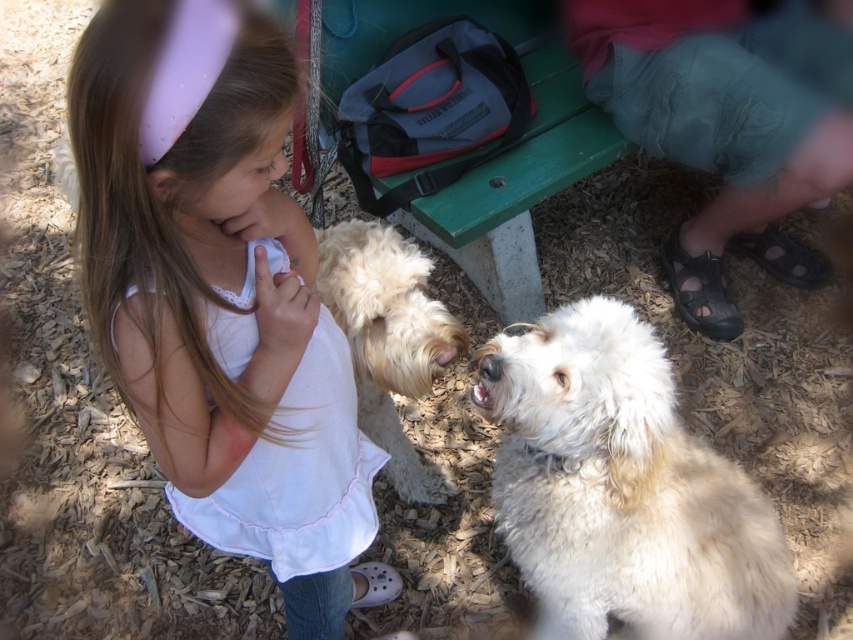
Who is positioned more to the right, white fluffy dog at center or fluffy white dog at center?

Positioned to the right is white fluffy dog at center.

Does white fluffy dog at center appear under fluffy white dog at center?

Yes.

Does point (514, 486) lie in front of point (399, 477)?

Yes.

You are a GUI agent. You are given a task and a screenshot of the screen. Output one action in this format:
    pyautogui.click(x=<x>, y=<y>)
    Task: Click on the white fluffy dog at center
    The width and height of the screenshot is (853, 640).
    Given the screenshot: What is the action you would take?
    pyautogui.click(x=624, y=490)

Can you confirm if fluffy white dog at center is bigger than white fur nose at center?

Correct, fluffy white dog at center is larger in size than white fur nose at center.

Does point (326, 296) come in front of point (485, 365)?

No, (326, 296) is behind (485, 365).

Locate an element on the screen. The width and height of the screenshot is (853, 640). fluffy white dog at center is located at coordinates (389, 339).

Where is `fluffy white dog at center`? The image size is (853, 640). fluffy white dog at center is located at coordinates (389, 339).

In order to click on white fluffy dog at center in this screenshot , I will do `click(624, 490)`.

Between point (618, 474) and point (479, 364), which one is positioned behind?

The point (479, 364) is behind.

At what (x,y) coordinates should I click in order to perform the action: click on white fluffy dog at center. Please return your answer as a coordinate pair (x, y). This screenshot has height=640, width=853. Looking at the image, I should click on (624, 490).